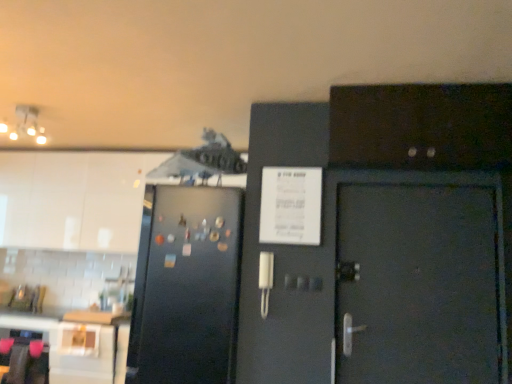
Question: Based on their positions, is white glossy table at lower left located to the left or right of black matte refrigerator at left?

Choices:
 (A) right
 (B) left

Answer: (B)

Question: Is white glossy table at lower left situated inside black matte refrigerator at left or outside?

Choices:
 (A) outside
 (B) inside

Answer: (A)

Question: Which object is positioned closest to the white glossy cabinet at upper left, marked as the 1th cabinetry in a back-to-front arrangement?

Choices:
 (A) white glossy table at lower left
 (B) matte white ceiling light at upper left
 (C) black matte refrigerator at left
 (D) dark wood cabinet at upper right, placed as the 1th cabinetry when sorted from front to back

Answer: (B)

Question: Estimate the real-world distances between objects in this image. Which object is closer to the matte white ceiling light at upper left?

Choices:
 (A) dark wood cabinet at upper right, placed as the 1th cabinetry when sorted from front to back
 (B) white glossy cabinet at upper left, marked as the 1th cabinetry in a back-to-front arrangement
 (C) black matte refrigerator at left
 (D) white glossy table at lower left

Answer: (B)